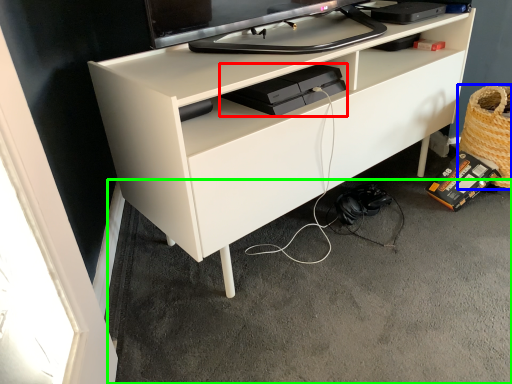
Question: Which object is positioned closest to equipment (highlighted by a red box)? Select from basket (highlighted by a blue box) and concrete (highlighted by a green box).

Choices:
 (A) basket
 (B) concrete

Answer: (B)